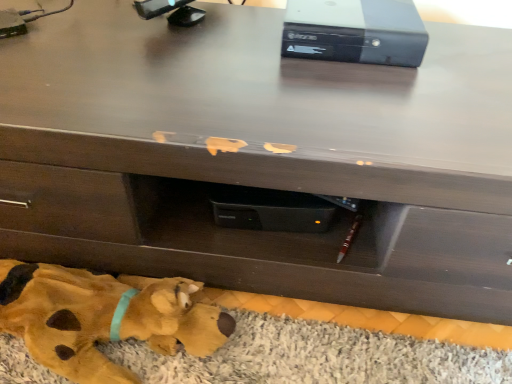
Question: Is point (53, 304) closer or farther from the camera than point (350, 374)?

Choices:
 (A) closer
 (B) farther

Answer: (A)

Question: From their relative heights in the image, would you say yellow plush toy at lower left is taller or shorter than yellow fabric mat at lower left?

Choices:
 (A) tall
 (B) short

Answer: (A)

Question: Which of these objects is positioned farthest from the yellow fabric mat at lower left?

Choices:
 (A) yellow plush toy at lower left
 (B) black plastic computer at upper center

Answer: (B)

Question: Considering the real-world distances, which object is closest to the yellow plush toy at lower left?

Choices:
 (A) yellow fabric mat at lower left
 (B) black plastic computer at upper center

Answer: (A)